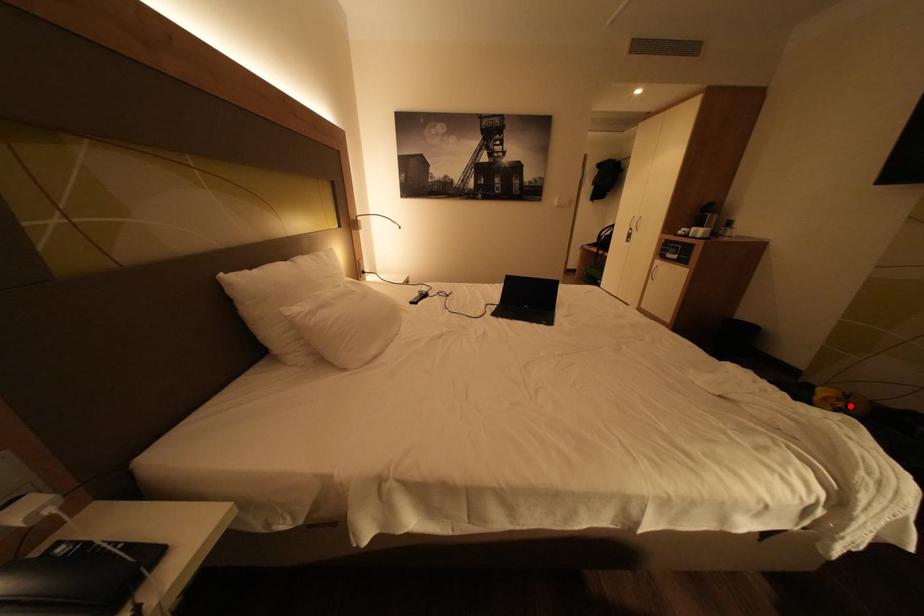
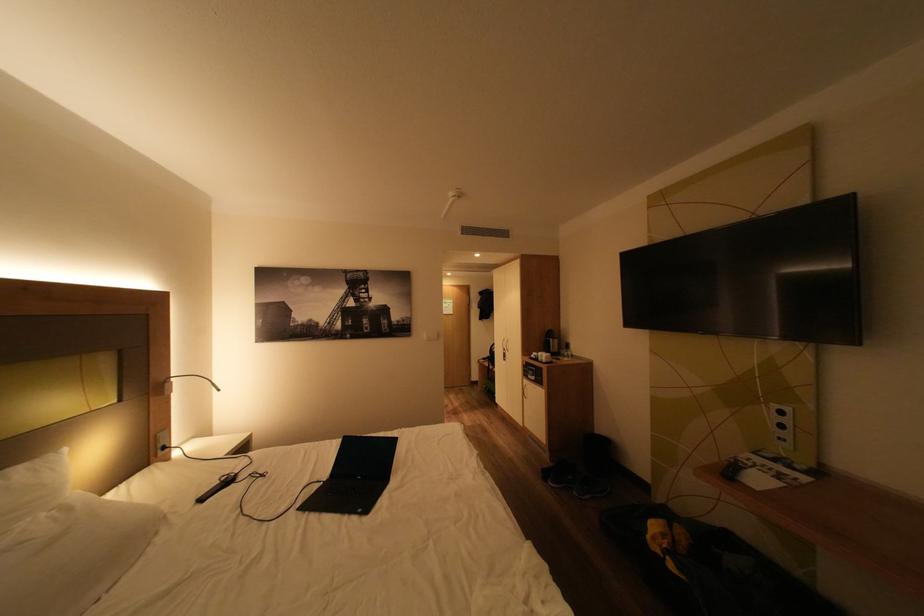
Question: I am providing you with two images of the same scene from different viewpoints. A red point is shown in image1. For the corresponding object point in image2, is it positioned nearer or farther from the camera?

Choices:
 (A) Nearer
 (B) Farther

Answer: (B)